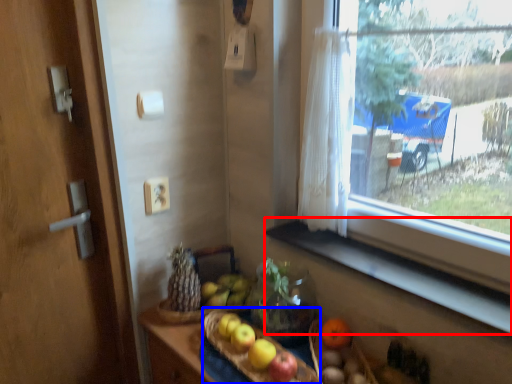
Question: Which object appears farthest to the camera in this image, window sill (highlighted by a red box) or basket (highlighted by a blue box)?

Choices:
 (A) window sill
 (B) basket

Answer: (B)